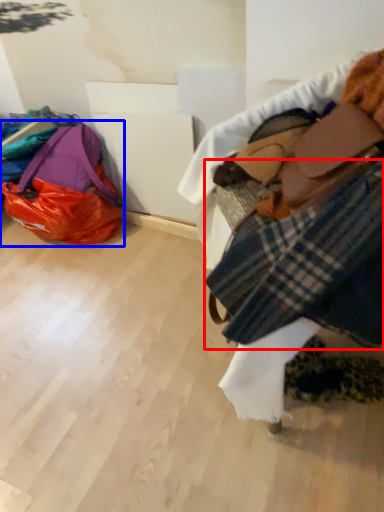
Question: Among these objects, which one is farthest to the camera, flannel (highlighted by a red box) or luggage and bags (highlighted by a blue box)?

Choices:
 (A) flannel
 (B) luggage and bags

Answer: (B)